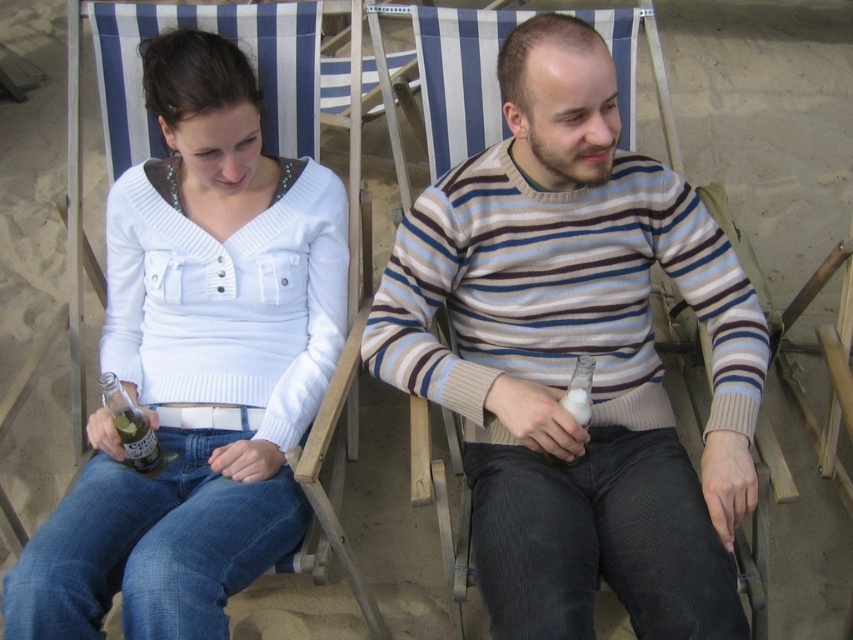
Can you confirm if white matte sweater at upper left is wider than clear glass bottle at lower left?

Correct, the width of white matte sweater at upper left exceeds that of clear glass bottle at lower left.

I want to click on white matte sweater at upper left, so click(196, 365).

Find the location of a particular element. Image resolution: width=853 pixels, height=640 pixels. white matte sweater at upper left is located at coordinates (196, 365).

Can you confirm if white matte sweater at upper left is bigger than clear glass bottle at center?

Yes.

Who is higher up, white matte sweater at upper left or clear glass bottle at center?

white matte sweater at upper left is higher up.

Which is in front, point (132, 630) or point (560, 458)?

Point (132, 630) is in front.

In order to click on white matte sweater at upper left in this screenshot , I will do `click(196, 365)`.

Can you confirm if striped sweater at center is bigger than clear glass bottle at center?

Yes, striped sweater at center is bigger than clear glass bottle at center.

Does striped sweater at center lie behind clear glass bottle at center?

No, it is in front of clear glass bottle at center.

Does point (503, 429) lie in front of point (573, 417)?

That is False.

Locate an element on the screen. This screenshot has height=640, width=853. striped sweater at center is located at coordinates (576, 356).